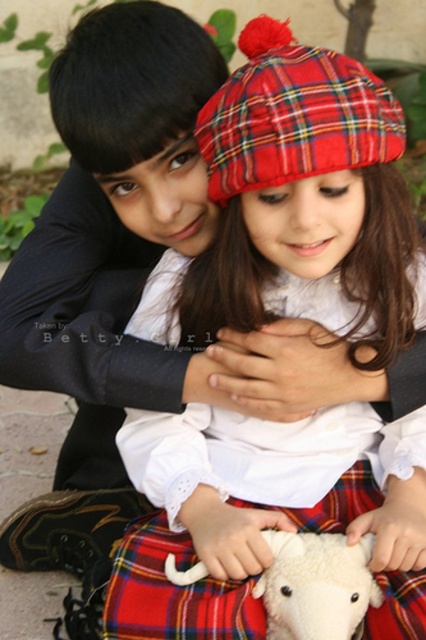
Question: Which point is farther to the camera?

Choices:
 (A) (333, 556)
 (B) (239, 220)

Answer: (B)

Question: Is red plaid kilt at lower center smaller than white soft lamb at center?

Choices:
 (A) no
 (B) yes

Answer: (A)

Question: Where is plaid fabric hat at upper center located in relation to red plaid kilt at lower center in the image?

Choices:
 (A) above
 (B) below

Answer: (A)

Question: Does red plaid kilt at lower center have a lesser width compared to white soft lamb at center?

Choices:
 (A) yes
 (B) no

Answer: (B)

Question: Which of the following is the closest to the observer?

Choices:
 (A) (416, 532)
 (B) (339, 572)
 (C) (141, 570)

Answer: (B)

Question: Estimate the real-world distances between objects in this image. Which object is farther from the red plaid kilt at lower center?

Choices:
 (A) plaid fabric hat at upper center
 (B) white soft lamb at center

Answer: (A)